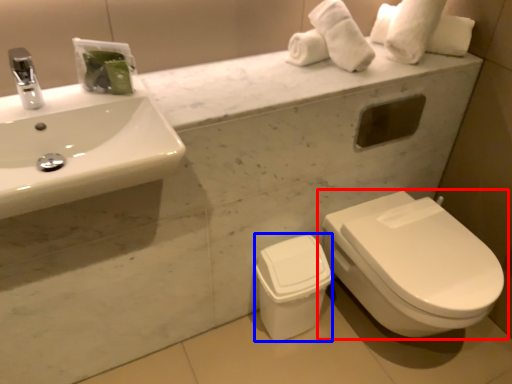
Question: Which object is closer to the camera taking this photo, toilet (highlighted by a red box) or porcelain (highlighted by a blue box)?

Choices:
 (A) toilet
 (B) porcelain

Answer: (A)